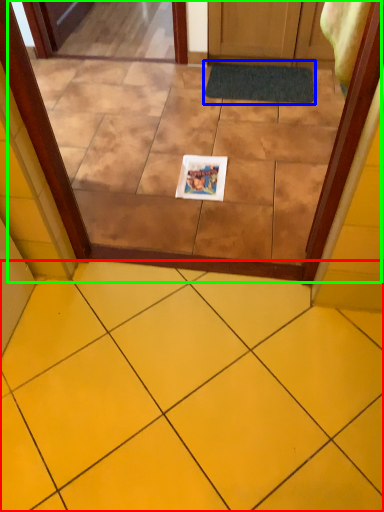
Question: Which is farther away from ceramic tile (highlighted by a red box)? bath mat (highlighted by a blue box) or glass door (highlighted by a green box)?

Choices:
 (A) bath mat
 (B) glass door

Answer: (A)